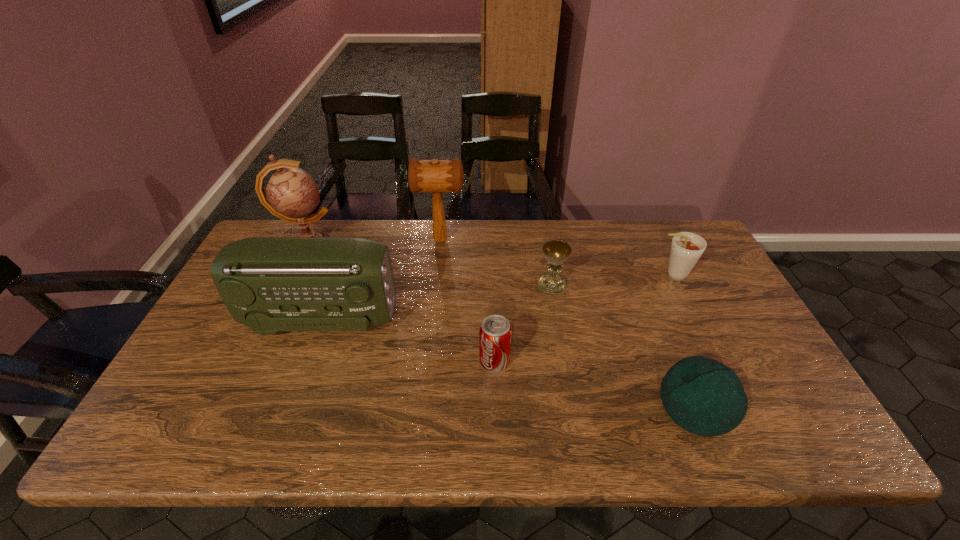
Identify the location of object present at the near edge. (703, 396).

Where is `globe at the left edge`? The height and width of the screenshot is (540, 960). globe at the left edge is located at coordinates (291, 194).

At what (x,y) coordinates should I click in order to perform the action: click on radio_receiver at the left edge. Please return your answer as a coordinate pair (x, y). This screenshot has height=540, width=960. Looking at the image, I should click on (270, 284).

The width and height of the screenshot is (960, 540). I want to click on root beer that is at the right edge, so click(x=686, y=249).

Locate an element on the screen. Image resolution: width=960 pixels, height=540 pixels. beanie at the right edge is located at coordinates (703, 396).

Locate an element on the screen. This screenshot has height=540, width=960. object present at the far left corner is located at coordinates (291, 194).

The width and height of the screenshot is (960, 540). Find the location of `object situated at the near right corner`. object situated at the near right corner is located at coordinates pyautogui.click(x=703, y=396).

This screenshot has height=540, width=960. In the image, there is a desktop. Find the location of `vacant area at the far edge`. vacant area at the far edge is located at coordinates (525, 224).

In the image, there is a desktop. At what (x,y) coordinates should I click in order to perform the action: click on vacant space at the near edge. Please return your answer as a coordinate pair (x, y). Looking at the image, I should click on (666, 426).

You are a GUI agent. You are given a task and a screenshot of the screen. Output one action in this format:
    pyautogui.click(x=<x>, y=<y>)
    Task: Click on the free space at the left edge
    
    Given the screenshot: What is the action you would take?
    pyautogui.click(x=210, y=327)